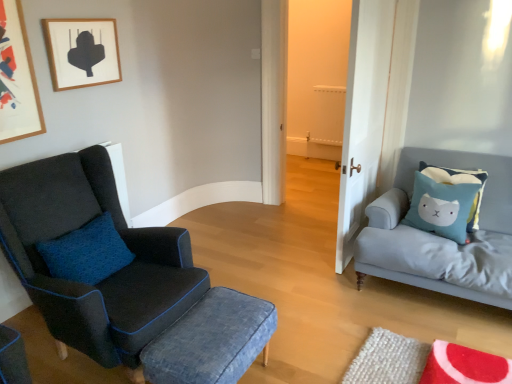
The width and height of the screenshot is (512, 384). Find the location of `wooden framed artwork at upper left, arranged as the 2th picture frame when viewed from the right`. wooden framed artwork at upper left, arranged as the 2th picture frame when viewed from the right is located at coordinates (17, 78).

Locate an element on the screen. This screenshot has width=512, height=384. denim fabric stool at center is located at coordinates (211, 340).

Describe the element at coordinates (362, 117) in the screenshot. The height and width of the screenshot is (384, 512). I see `white wood door at center` at that location.

Image resolution: width=512 pixels, height=384 pixels. In order to click on wooden framed artwork at upper left, which is counted as the 1th picture frame, starting from the left in this screenshot , I will do `click(17, 78)`.

From the image's perspective, which picture frame is the 2nd one above the matte black armchair at left? Please provide its 2D coordinates.

[(82, 52)]

Between wooden picture frame at upper left, the second picture frame positioned from the left, and matte black armchair at left, which one has larger width?

matte black armchair at left is wider.

From a real-world perspective, does wooden picture frame at upper left, the second picture frame positioned from the left, sit lower than matte black armchair at left?

No, from a real-world perspective, wooden picture frame at upper left, the second picture frame positioned from the left, is not under matte black armchair at left.

Measure the distance from wooden picture frame at upper left, the first picture frame when ordered from right to left, to matte black armchair at left.

They are 1.04 meters apart.

Is wooden picture frame at upper left, the second picture frame positioned from the left, not within light gray fabric studio couch at right?

wooden picture frame at upper left, the second picture frame positioned from the left, is positioned outside light gray fabric studio couch at right.

Considering the points (81, 80) and (481, 218), which point is in front, point (81, 80) or point (481, 218)?

The point (81, 80) is closer to the camera.

Can you confirm if wooden picture frame at upper left, the second picture frame positioned from the left, is thinner than light gray fabric studio couch at right?

Yes.

Is denim fabric stool at center smaller than light gray fabric studio couch at right?

Yes, denim fabric stool at center is smaller than light gray fabric studio couch at right.

Is denim fabric stool at center completely or partially outside of light gray fabric studio couch at right?

Yes, denim fabric stool at center is not within light gray fabric studio couch at right.

Considering the sizes of denim fabric stool at center and light gray fabric studio couch at right in the image, is denim fabric stool at center wider or thinner than light gray fabric studio couch at right?

Considering their sizes, denim fabric stool at center looks slimmer than light gray fabric studio couch at right.

Locate an element on the screen. This screenshot has width=512, height=384. stool below the light gray fabric studio couch at right (from the image's perspective) is located at coordinates (211, 340).

From a real-world perspective, is light blue fabric cushion at right below wooden framed artwork at upper left, which is counted as the 1th picture frame, starting from the left?

Yes.

In the image, is light blue fabric cushion at right positioned in front of or behind wooden framed artwork at upper left, arranged as the 2th picture frame when viewed from the right?

light blue fabric cushion at right is behind wooden framed artwork at upper left, arranged as the 2th picture frame when viewed from the right.

Is light blue fabric cushion at right not close to wooden framed artwork at upper left, which is counted as the 1th picture frame, starting from the left?

Absolutely, light blue fabric cushion at right is distant from wooden framed artwork at upper left, which is counted as the 1th picture frame, starting from the left.

Does point (443, 181) appear closer or farther from the camera than point (12, 111)?

Point (443, 181) is positioned farther from the camera compared to point (12, 111).

Measure the distance between wooden picture frame at upper left, the second picture frame positioned from the left, and wooden framed artwork at upper left, which is counted as the 1th picture frame, starting from the left.

wooden picture frame at upper left, the second picture frame positioned from the left, and wooden framed artwork at upper left, which is counted as the 1th picture frame, starting from the left, are 31.99 centimeters apart.

Is wooden picture frame at upper left, the second picture frame positioned from the left, behind wooden framed artwork at upper left, which is counted as the 1th picture frame, starting from the left?

Yes, wooden picture frame at upper left, the second picture frame positioned from the left, is further from the viewer.

Could wooden framed artwork at upper left, which is counted as the 1th picture frame, starting from the left, be considered to be inside wooden picture frame at upper left, the first picture frame when ordered from right to left?

That's incorrect, wooden framed artwork at upper left, which is counted as the 1th picture frame, starting from the left, is not inside wooden picture frame at upper left, the first picture frame when ordered from right to left.

From the picture: Can you see wooden picture frame at upper left, the first picture frame when ordered from right to left, touching wooden framed artwork at upper left, which is counted as the 1th picture frame, starting from the left?

No.

Locate an element on the screen. The image size is (512, 384). stool to the left of white wood door at center is located at coordinates (211, 340).

From the picture: What's the angular difference between denim fabric stool at center and white wood door at center's facing directions?

The facing directions of denim fabric stool at center and white wood door at center are 180 degrees apart.

Is denim fabric stool at center at the left side of white wood door at center?

Yes, denim fabric stool at center is to the left of white wood door at center.

Considering the relative sizes of denim fabric stool at center and white wood door at center in the image provided, is denim fabric stool at center shorter than white wood door at center?

Correct, denim fabric stool at center is not as tall as white wood door at center.

How many degrees apart are the facing directions of white wood door at center and wooden picture frame at upper left, the second picture frame positioned from the left?

180 degrees.

From the image's perspective, count 2nd picture frames upward from the white wood door at center and point to it. Please provide its 2D coordinates.

[(82, 52)]

Considering the sizes of objects white wood door at center and wooden picture frame at upper left, the second picture frame positioned from the left, in the image provided, who is taller, white wood door at center or wooden picture frame at upper left, the second picture frame positioned from the left,?

With more height is white wood door at center.

Which object is further away from the camera taking this photo, white wood door at center or wooden picture frame at upper left, the first picture frame when ordered from right to left?

wooden picture frame at upper left, the first picture frame when ordered from right to left, is more distant.

Where is `picture frame that is the 1st one when counting leftward from the matte black armchair at left`? Image resolution: width=512 pixels, height=384 pixels. picture frame that is the 1st one when counting leftward from the matte black armchair at left is located at coordinates (82, 52).

Identify the location of studio couch on the right side of wooden picture frame at upper left, the first picture frame when ordered from right to left. 421,233.

From the picture: Which object lies further to the anchor point wooden picture frame at upper left, the second picture frame positioned from the left, light gray fabric studio couch at right or wooden framed artwork at upper left, which is counted as the 1th picture frame, starting from the left?

Among the two, light gray fabric studio couch at right is located further to wooden picture frame at upper left, the second picture frame positioned from the left.

When comparing their distances from light blue fabric cushion at right, does denim fabric stool at center or light gray fabric studio couch at right seem further?

denim fabric stool at center is further to light blue fabric cushion at right.

Estimate the real-world distances between objects in this image. Which object is further from denim fabric stool at center, matte black armchair at left or wooden picture frame at upper left, the first picture frame when ordered from right to left?

wooden picture frame at upper left, the first picture frame when ordered from right to left, is positioned further to the anchor denim fabric stool at center.

Based on their spatial positions, is wooden picture frame at upper left, the first picture frame when ordered from right to left, or wooden framed artwork at upper left, arranged as the 2th picture frame when viewed from the right, further from light gray fabric studio couch at right?

Based on the image, wooden framed artwork at upper left, arranged as the 2th picture frame when viewed from the right, appears to be further to light gray fabric studio couch at right.

Looking at the image, which one is located further to light gray fabric studio couch at right, light blue fabric cushion at right or white wood door at center?

white wood door at center is further to light gray fabric studio couch at right.

Based on the photo, estimate the real-world distances between objects in this image. Which object is further from light blue fabric cushion at right, wooden picture frame at upper left, the first picture frame when ordered from right to left, or white wood door at center?

Among the two, wooden picture frame at upper left, the first picture frame when ordered from right to left, is located further to light blue fabric cushion at right.

Estimate the real-world distances between objects in this image. Which object is closer to light blue fabric cushion at right, wooden picture frame at upper left, the first picture frame when ordered from right to left, or denim fabric stool at center?

denim fabric stool at center lies closer to light blue fabric cushion at right than the other object.

Based on the photo, looking at the image, which one is located closer to matte black armchair at left, wooden framed artwork at upper left, arranged as the 2th picture frame when viewed from the right, or light gray fabric studio couch at right?

The object closer to matte black armchair at left is wooden framed artwork at upper left, arranged as the 2th picture frame when viewed from the right.

Find the location of a particular element. The height and width of the screenshot is (384, 512). picture frame that lies between wooden picture frame at upper left, the first picture frame when ordered from right to left, and denim fabric stool at center from top to bottom is located at coordinates (17, 78).

Locate an element on the screen. Image resolution: width=512 pixels, height=384 pixels. stool located between wooden framed artwork at upper left, which is counted as the 1th picture frame, starting from the left, and light gray fabric studio couch at right in the left-right direction is located at coordinates (211, 340).

Identify the location of chair between wooden picture frame at upper left, the second picture frame positioned from the left, and white wood door at center from left to right. The image size is (512, 384). (126, 281).

This screenshot has height=384, width=512. I want to click on studio couch located between matte black armchair at left and light blue fabric cushion at right in the left-right direction, so click(421, 233).